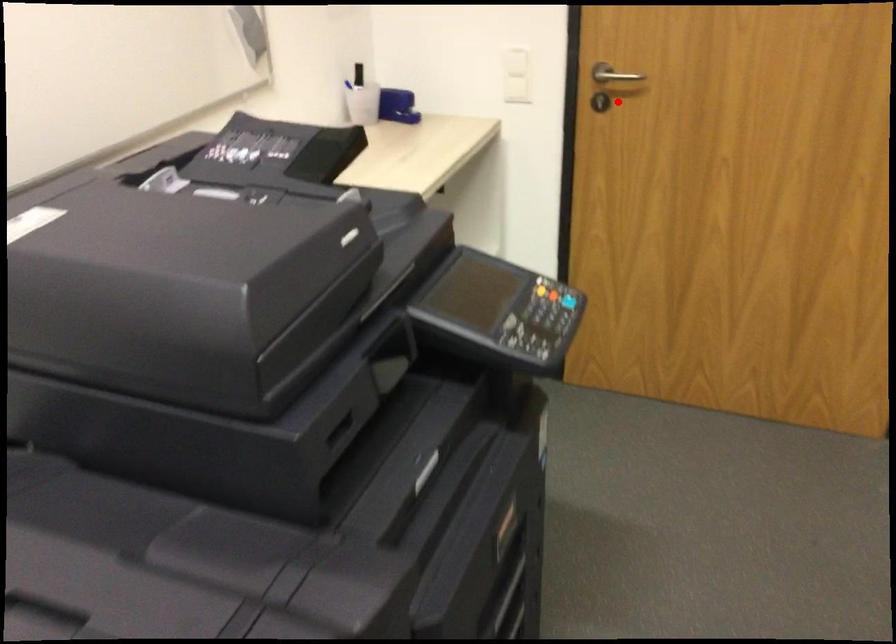
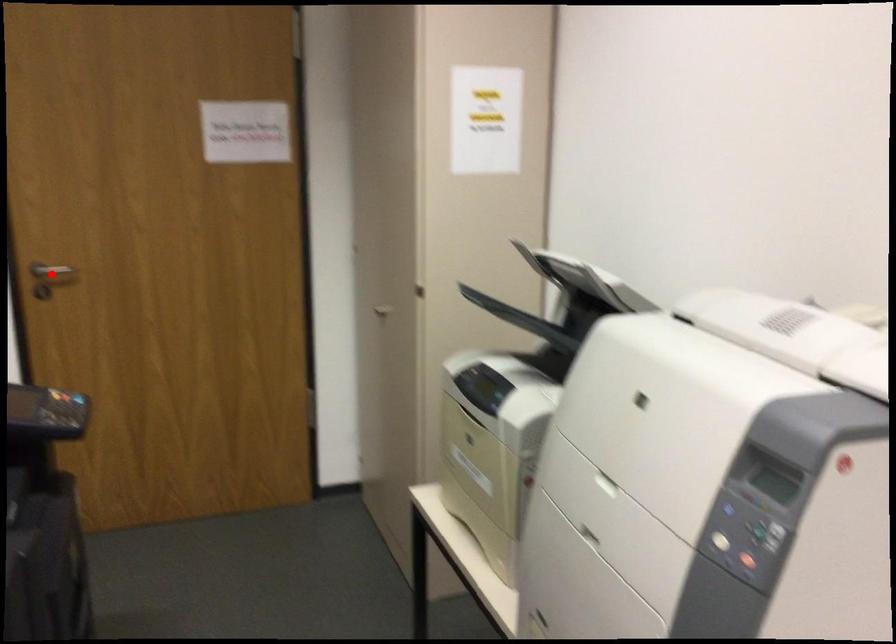
I am providing you with two images of the same scene from different viewpoints. A red point is marked on the first image and another point is marked on the second image. Is the red point in image1 aligned with the point shown in image2?

Yes